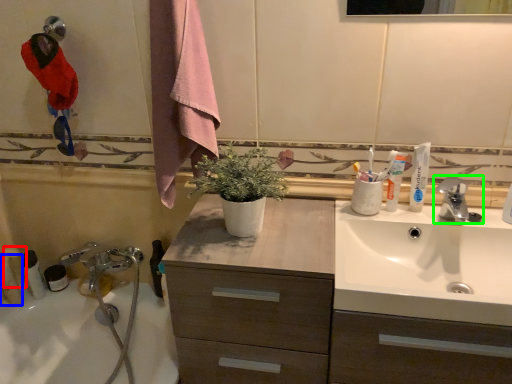
Question: Considering the real-world distances, which object is farthest from toiletry (highlighted by a red box)? toiletry (highlighted by a blue box) or tap (highlighted by a green box)?

Choices:
 (A) toiletry
 (B) tap

Answer: (B)